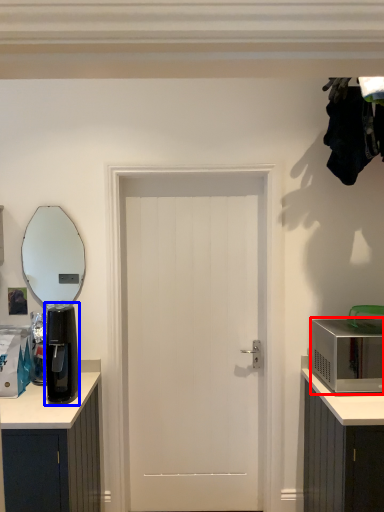
Question: Which object appears closest to the camera in this image, microwave oven (highlighted by a red box) or appliance (highlighted by a blue box)?

Choices:
 (A) microwave oven
 (B) appliance

Answer: (B)